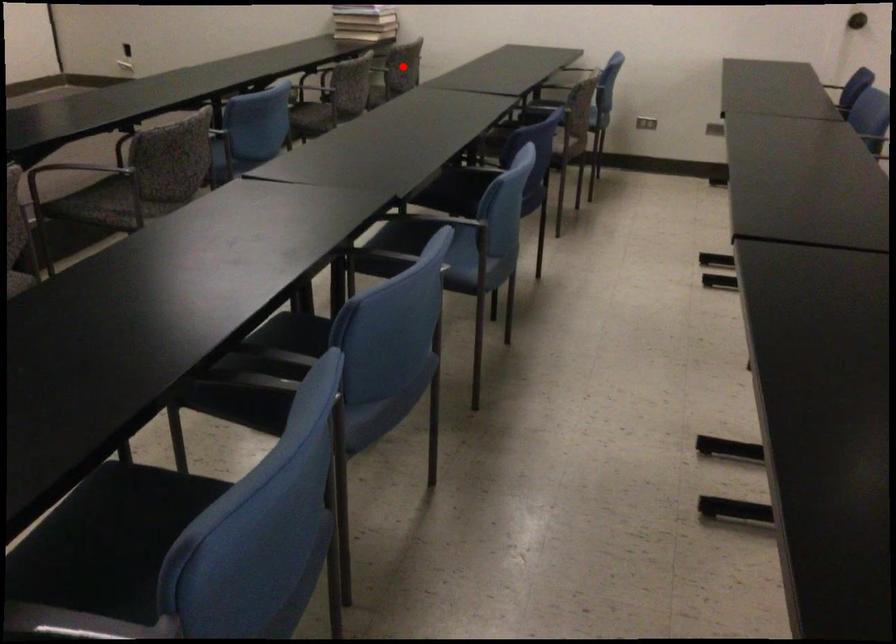
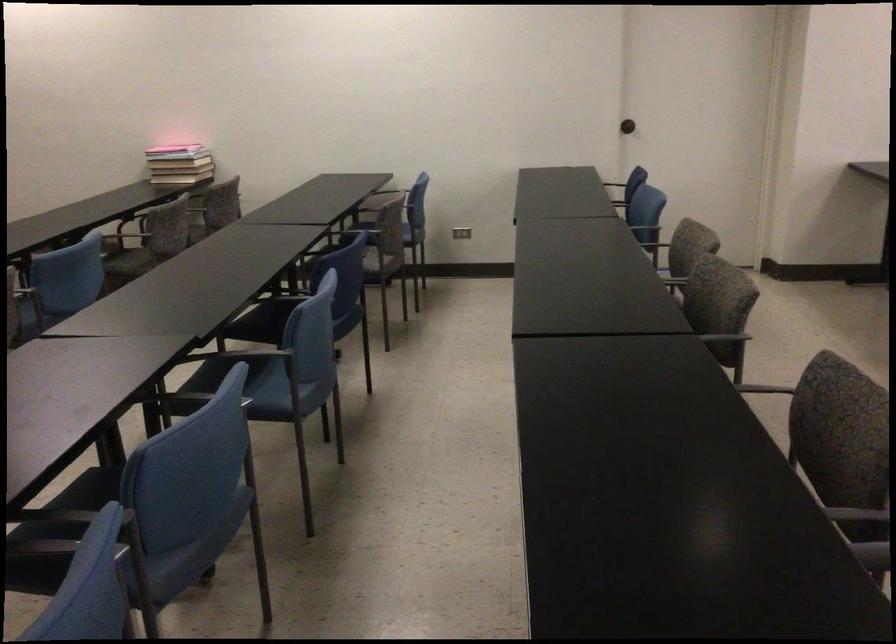
In the second image, find the point that corresponds to the highlighted location in the first image.

(221, 204)